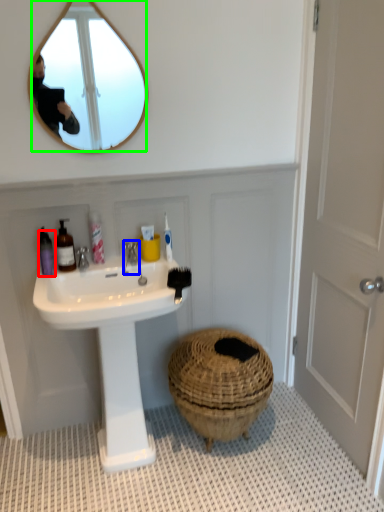
Question: Estimate the real-world distances between objects in this image. Which object is farther from toiletry (highlighted by a red box), faucet (highlighted by a blue box) or mirror (highlighted by a green box)?

Choices:
 (A) faucet
 (B) mirror

Answer: (B)